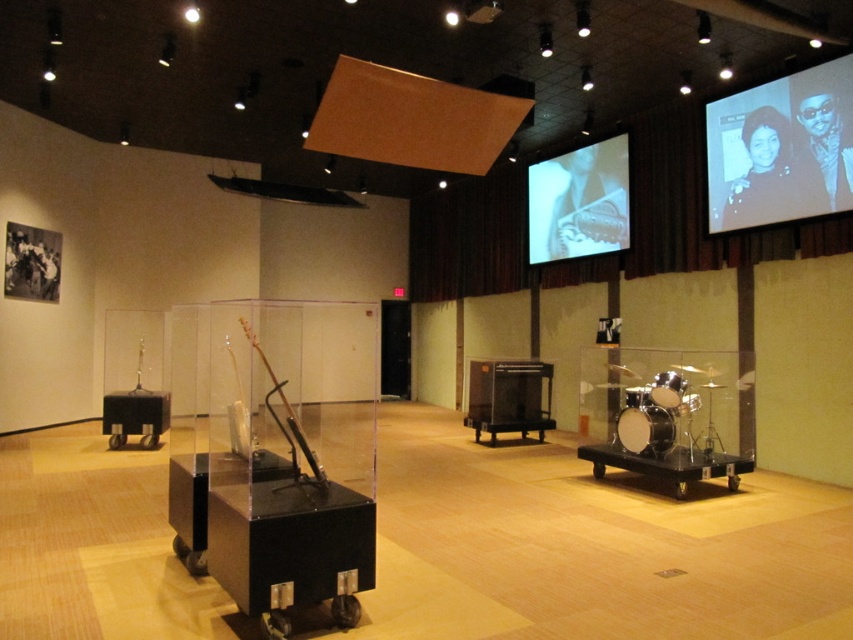
You are a visitor in the exhibition space and want to take a photo of the black glossy projection screen at upper right without any display cases blocking the view. Are the display cases positioned in a way that they might obstruct your view of the screen?

The black glossy projection screen at upper right is located at point (781, 148), which is in the upper right area of the scene. Since the display cases are positioned in the foreground and lower part of the image, they are unlikely to obstruct the view of the screen. You can take the photo without any issues.

You are standing in the exhibition space and looking at the display cases. Which of the two points, point (772, 168) or point (625, 195), is closer to you?

Point (772, 168) is closer to the camera than point (625, 195), so it is closer to you.